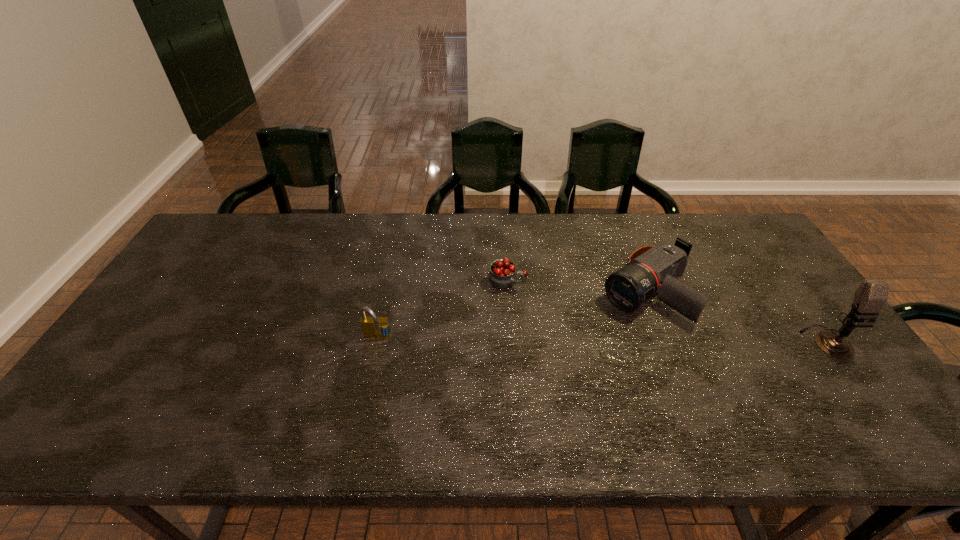
Find the location of a particular element. This screenshot has width=960, height=540. the leftmost object is located at coordinates (373, 327).

Identify the location of microphone. The width and height of the screenshot is (960, 540). (872, 294).

Locate an element on the screen. the tallest object is located at coordinates (872, 294).

Image resolution: width=960 pixels, height=540 pixels. What are the coordinates of `pot filled with cherries` in the screenshot? It's located at (503, 272).

Locate an element on the screen. the third object from left to right is located at coordinates (650, 270).

Where is `free location located 0.130m on the side with the combination dials of the padlock`? free location located 0.130m on the side with the combination dials of the padlock is located at coordinates (367, 388).

Where is `blank area located 0.100m on the front-facing side of the microphone`? blank area located 0.100m on the front-facing side of the microphone is located at coordinates (865, 393).

You are a GUI agent. You are given a task and a screenshot of the screen. Output one action in this format:
    pyautogui.click(x=<x>, y=<y>)
    Task: Click on the vacant space located on the handle side of the second object from left to right
    Image resolution: width=960 pixels, height=540 pixels.
    Given the screenshot: What is the action you would take?
    pyautogui.click(x=623, y=331)

I want to click on free location located 0.050m on the handle side of the second object from left to right, so click(x=540, y=295).

This screenshot has height=540, width=960. In order to click on vacant region located on the handle side of the second object from left to right in this screenshot , I will do `click(563, 305)`.